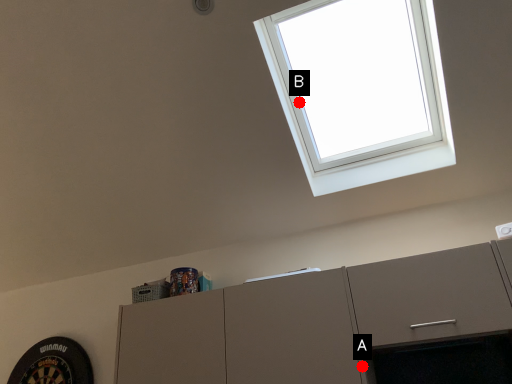
Question: Two points are circled on the image, labeled by A and B beside each circle. Which of the following is the closest to the observer?

Choices:
 (A) A is closer
 (B) B is closer

Answer: (A)